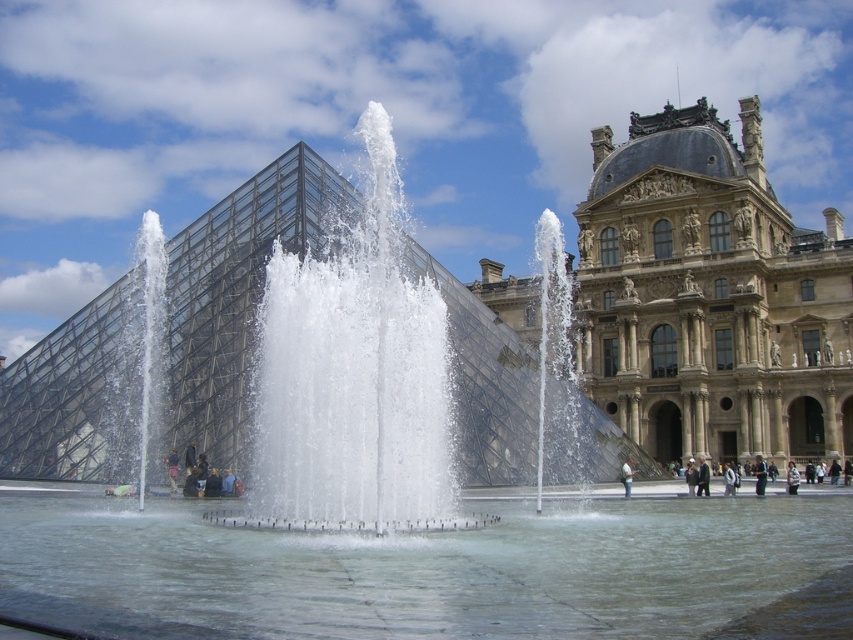
Is golden stone palace at center to the left of dark blue jeans at center from the viewer's perspective?

Indeed, golden stone palace at center is positioned on the left side of dark blue jeans at center.

Can you confirm if golden stone palace at center is positioned below dark blue jeans at center?

No.

At what (x,y) coordinates should I click in order to perform the action: click on golden stone palace at center. Please return your answer as a coordinate pair (x, y). This screenshot has height=640, width=853. Looking at the image, I should click on (708, 301).

Locate an element on the screen. golden stone palace at center is located at coordinates (708, 301).

Between clear water at center and light brown leather jacket at center, which one is positioned higher?

clear water at center is above.

Is clear water at center thinner than light brown leather jacket at center?

No.

Who is more forward, (380,429) or (627,492)?

Point (380,429)

Identify the location of clear water at center. The height and width of the screenshot is (640, 853). (354, 381).

Does clear water at center have a greater width compared to dark blue jeans at center?

Yes.

Between clear water at center and dark blue jeans at center, which one appears on the left side from the viewer's perspective?

From the viewer's perspective, clear water at center appears more on the left side.

Is point (305, 316) less distant than point (761, 483)?

Yes, point (305, 316) is closer to viewer.

This screenshot has height=640, width=853. I want to click on clear water at center, so click(354, 381).